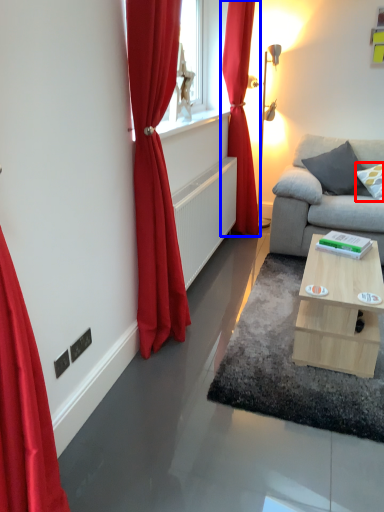
Question: Which of the following is the farthest to the observer, pillow (highlighted by a red box) or curtain (highlighted by a blue box)?

Choices:
 (A) pillow
 (B) curtain

Answer: (A)